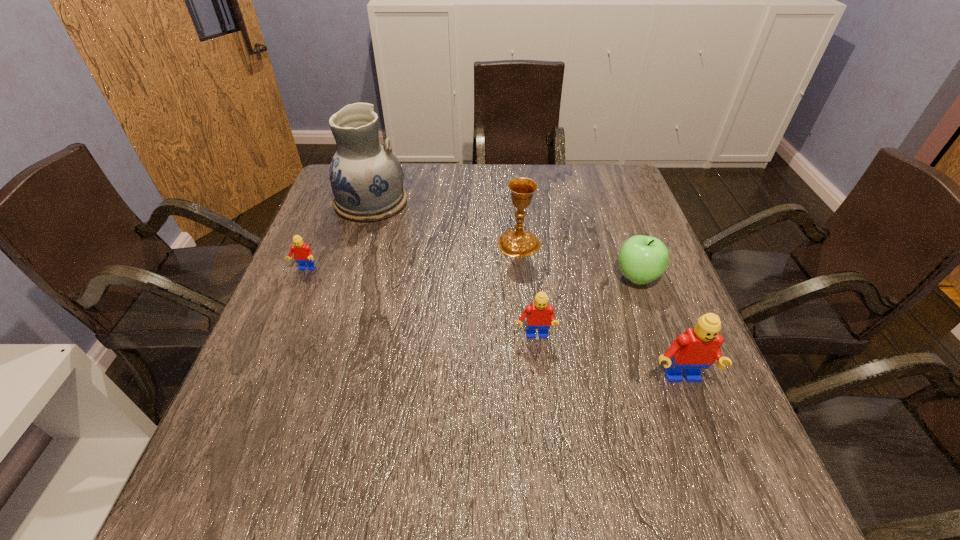
Locate an element on the screen. object that can be found as the third closest to the pottery is located at coordinates (539, 315).

I want to click on the closest Lego relative to the tallest Lego, so click(539, 315).

The width and height of the screenshot is (960, 540). Identify the location of Lego object that ranks as the third closest to the farthest object. (697, 348).

Identify the location of vacant space that satisfies the following two spatial constraints: 1. on the front side of the apple; 2. on the left side of the second farthest object. (522, 278).

Where is `free space in the image that satisfies the following two spatial constraints: 1. on the front-facing side of the leftmost Lego; 2. on the right side of the apple`? The width and height of the screenshot is (960, 540). free space in the image that satisfies the following two spatial constraints: 1. on the front-facing side of the leftmost Lego; 2. on the right side of the apple is located at coordinates (302, 278).